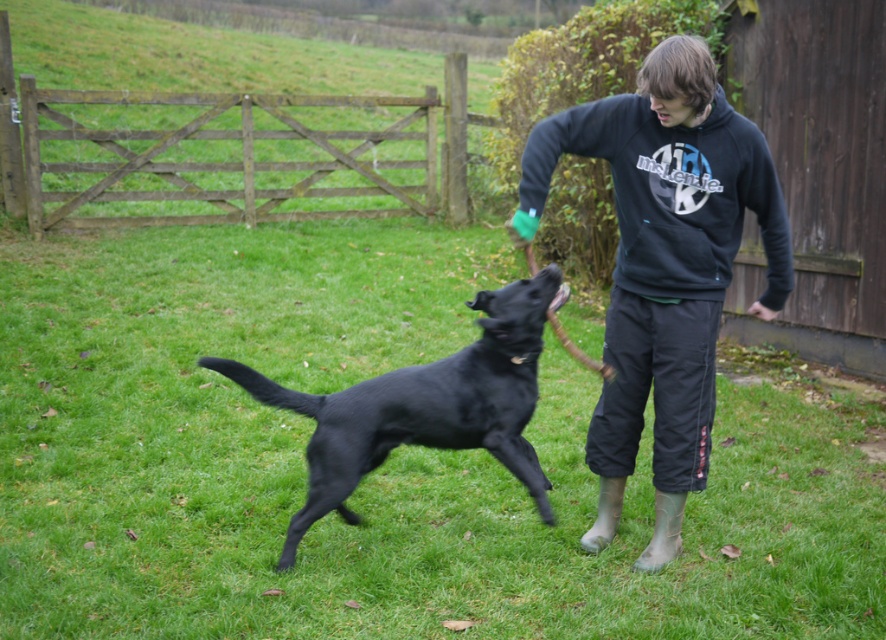
Question: Estimate the real-world distances between objects in this image. Which object is closer to the shiny black dog at center?

Choices:
 (A) dark blue hoodie at center
 (B) green grass at center
 (C) matte black sweatshirt at upper right

Answer: (A)

Question: Is green grass at center above shiny black dog at center?

Choices:
 (A) yes
 (B) no

Answer: (A)

Question: Which point appears farthest from the camera in this image?

Choices:
 (A) (470, 435)
 (B) (659, 218)

Answer: (A)

Question: Considering the relative positions of green grass at center and shiny black dog at center in the image provided, where is green grass at center located with respect to shiny black dog at center?

Choices:
 (A) right
 (B) left

Answer: (B)

Question: Considering the real-world distances, which object is closest to the shiny black dog at center?

Choices:
 (A) green grass at center
 (B) dark blue hoodie at center

Answer: (B)

Question: Does matte black sweatshirt at upper right come in front of shiny black dog at center?

Choices:
 (A) no
 (B) yes

Answer: (B)